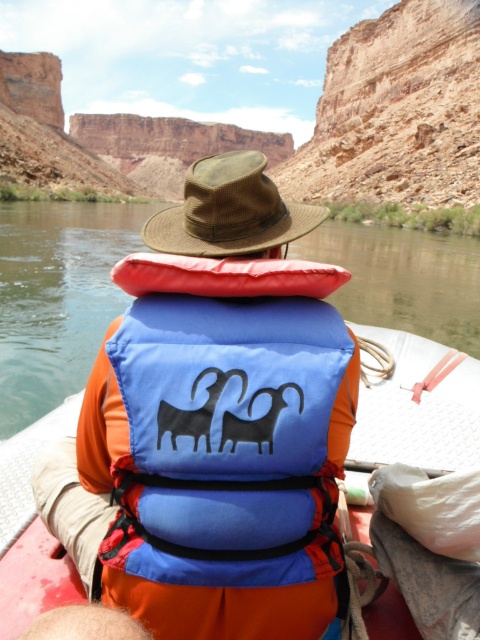
Based on the photo, can you confirm if green rubber raft at center is wider than brown woven hat at center?

Correct, the width of green rubber raft at center exceeds that of brown woven hat at center.

Between green rubber raft at center and brown woven hat at center, which one appears on the left side from the viewer's perspective?

From the viewer's perspective, green rubber raft at center appears more on the left side.

Which is in front, point (47, 218) or point (261, 176)?

Point (261, 176)

Where is `green rubber raft at center`? green rubber raft at center is located at coordinates (57, 298).

Who is lower down, blue fabric life jacket at center or brown woven hat at center?

Positioned lower is blue fabric life jacket at center.

Which of these two, blue fabric life jacket at center or brown woven hat at center, stands taller?

Standing taller between the two is blue fabric life jacket at center.

This screenshot has width=480, height=640. What do you see at coordinates (222, 445) in the screenshot? I see `blue fabric life jacket at center` at bounding box center [222, 445].

Where is `blue fabric life jacket at center`? The width and height of the screenshot is (480, 640). blue fabric life jacket at center is located at coordinates [222, 445].

Image resolution: width=480 pixels, height=640 pixels. Identify the location of blue fabric life jacket at center. (222, 445).

The height and width of the screenshot is (640, 480). I want to click on blue fabric life jacket at center, so click(x=222, y=445).